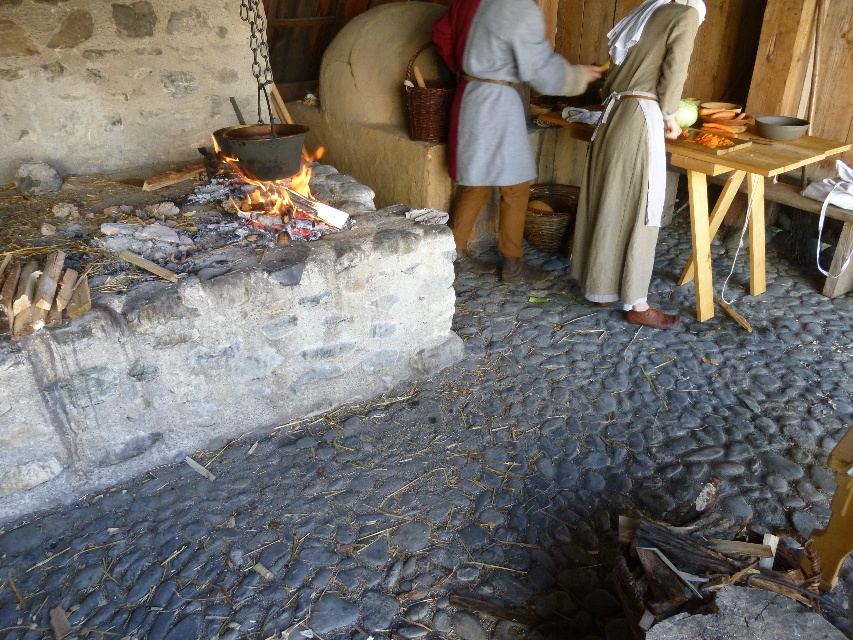
You are standing in the historical kitchen scene. There is a light brown linen robe at center. If you want to move towards the robe, in which direction should you walk from your current position?

The light brown linen robe at center is located at coordinates point (631, 150), so you should walk towards the lower center direction to reach it.

You are a visitor at a historical reenactment and see two people wearing the light brown linen robe at center and the gray woolen robe at center. Which person is wearing the smaller robe?

The light brown linen robe at center is smaller than the gray woolen robe at center, so the person wearing the light brown linen robe at center has the smaller robe.

You are standing in the historical kitchen scene. You see a point at coordinates (x=631, y=150). What object is located at that point?

The point at coordinates (x=631, y=150) corresponds to the light brown linen robe at center.